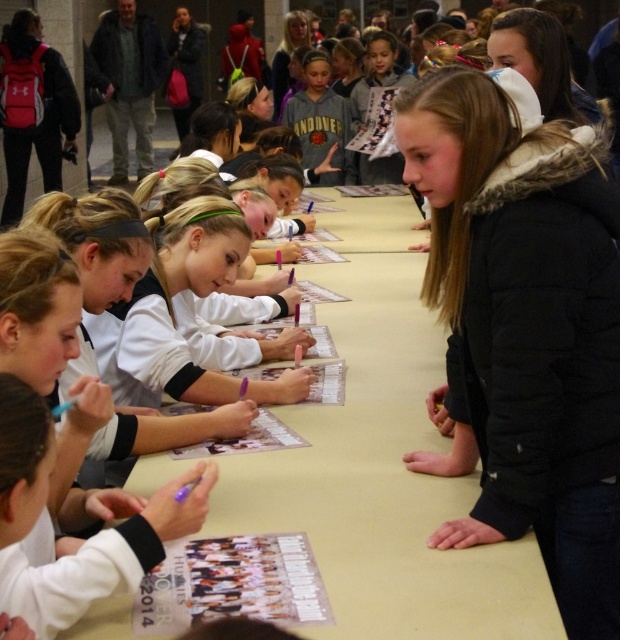
Question: Is black fuzzy jacket at center bigger than beige paper at center?

Choices:
 (A) no
 (B) yes

Answer: (A)

Question: Which point is closer to the camera?

Choices:
 (A) black fuzzy jacket at center
 (B) beige paper at center
 (C) gray hoodie at center

Answer: (B)

Question: Which is nearer to the gray hoodie at center?

Choices:
 (A) beige paper at center
 (B) black fuzzy jacket at center

Answer: (A)

Question: Which object is positioned farthest from the black fuzzy jacket at center?

Choices:
 (A) beige paper at center
 (B) gray hoodie at center

Answer: (B)

Question: Is beige paper at center bigger than gray hoodie at center?

Choices:
 (A) no
 (B) yes

Answer: (B)

Question: Is beige paper at center wider than gray hoodie at center?

Choices:
 (A) yes
 (B) no

Answer: (A)